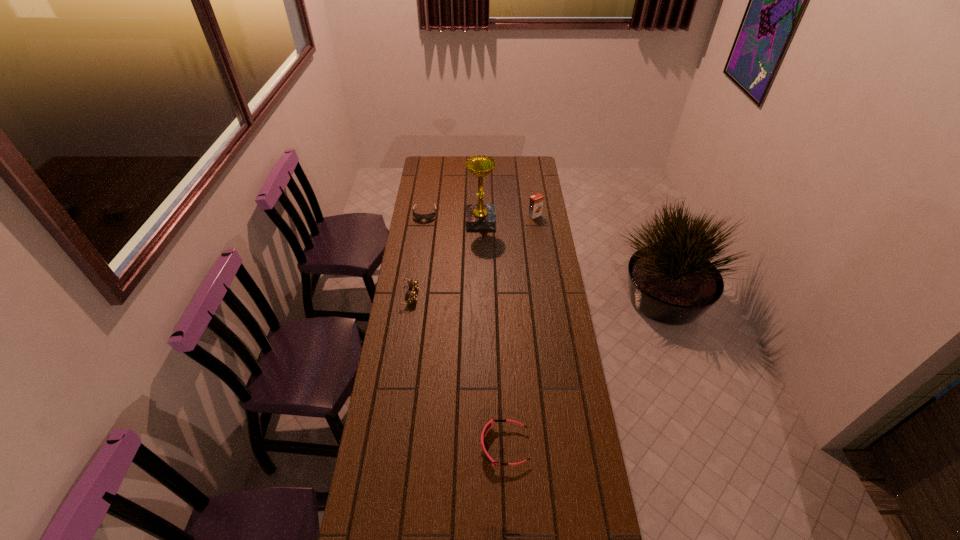
You are a GUI agent. You are given a task and a screenshot of the screen. Output one action in this format:
    pyautogui.click(x=<x>, y=<y>)
    Task: Click on the tallest object
    The height and width of the screenshot is (540, 960).
    Given the screenshot: What is the action you would take?
    pyautogui.click(x=478, y=216)

The width and height of the screenshot is (960, 540). I want to click on the second tallest object, so click(x=536, y=201).

Identify the location of orange juice. The image size is (960, 540). (536, 201).

Where is `the second nearest object`? the second nearest object is located at coordinates (411, 296).

I want to click on the rightmost goggles, so pos(489,424).

Where is `the nearest goggles`? the nearest goggles is located at coordinates tap(489, 424).

This screenshot has width=960, height=540. I want to click on the farthest goggles, so click(x=430, y=216).

The width and height of the screenshot is (960, 540). Find the location of `the shortest goggles`. the shortest goggles is located at coordinates (430, 216).

This screenshot has width=960, height=540. Identify the location of blank area located 0.140m on the front-facing side of the tallest object. (440, 220).

Locate an element on the screen. vacant space located on the front-facing side of the tallest object is located at coordinates (442, 220).